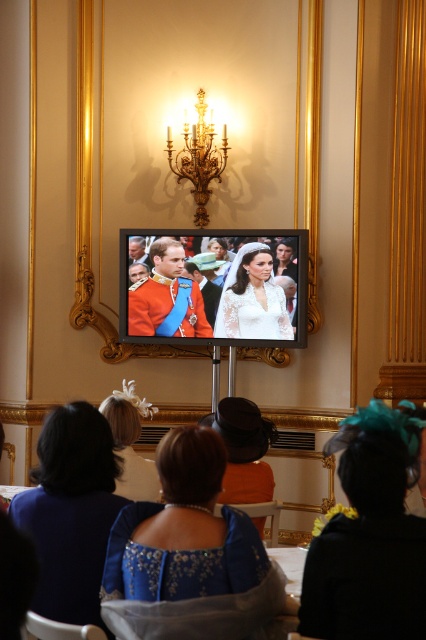
Question: Does white feathered hat at center appear over gold/gilded chandelier at upper center?

Choices:
 (A) no
 (B) yes

Answer: (A)

Question: Which object is positioned closest to the blue satin dress at lower center?

Choices:
 (A) lace fabric dress at center
 (B) metallic gold frame at upper center
 (C) gold/gilded chandelier at upper center

Answer: (A)

Question: Among these points, which one is farthest from the camera?

Choices:
 (A) (201, 186)
 (B) (103, 403)
 (C) (244, 305)
 (D) (175, 257)

Answer: (A)

Question: Considering the real-world distances, which object is closest to the lace fabric dress at center?

Choices:
 (A) white feathered hat at center
 (B) metallic gold frame at upper center
 (C) matte orange uniform at center

Answer: (C)

Question: Does blue satin dress at lower center appear under metallic gold frame at upper center?

Choices:
 (A) no
 (B) yes

Answer: (B)

Question: Is metallic gold frame at upper center further to camera compared to white feathered hat at center?

Choices:
 (A) yes
 (B) no

Answer: (A)